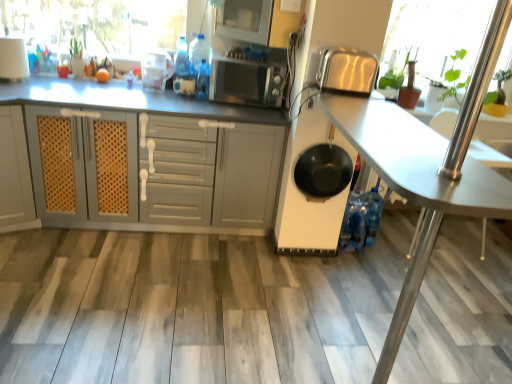
Question: From the image's perspective, relative to green leafy plant at upper right, the second window screen viewed from the left, is white matte cabinet at center above or below?

Choices:
 (A) below
 (B) above

Answer: (A)

Question: Considering the positions of white matte cabinet at center and green leafy plant at upper right, positioned as the 1th window screen in right-to-left order, in the image, is white matte cabinet at center taller or shorter than green leafy plant at upper right, positioned as the 1th window screen in right-to-left order,?

Choices:
 (A) short
 (B) tall

Answer: (B)

Question: Based on their relative distances, which object is nearer to the satin silver toaster at upper right, which is the 1th appliance in right-to-left order?

Choices:
 (A) satin silver microwave at center
 (B) metallic silver table at center
 (C) white matte cabinet at center
 (D) transparent glass door at right
 (E) transparent plastic container at upper center, the second appliance positioned from the left

Answer: (B)

Question: Which of these objects is positioned farthest from the satin silver microwave at center?

Choices:
 (A) transparent glass door at right
 (B) white matte cabinet at center
 (C) green leafy plant at upper right, positioned as the 1th window screen in right-to-left order
 (D) metallic silver table at center
 (E) black matte frying pan at center

Answer: (A)